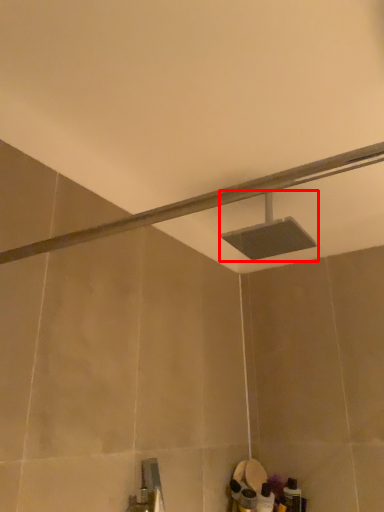
Question: From the image's perspective, where is shower (annotated by the red box) located in relation to shower in the image?

Choices:
 (A) below
 (B) above

Answer: (B)